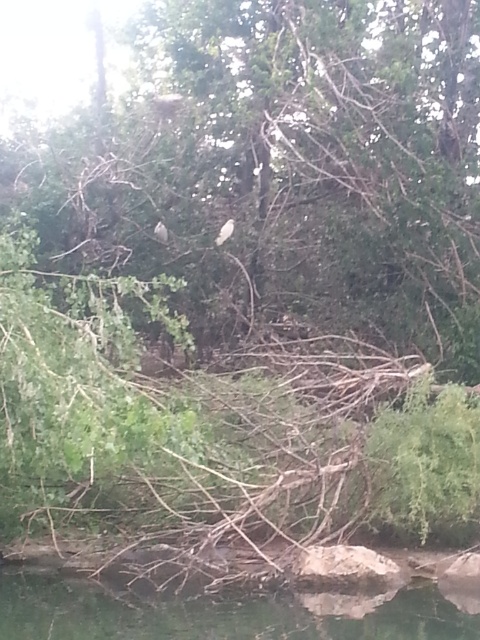
Question: Is green leafy tree at center further to camera compared to white matte bird at upper center?

Choices:
 (A) no
 (B) yes

Answer: (A)

Question: Which of the following is the closest to the observer?

Choices:
 (A) green leafy tree at center
 (B) white matte bird at upper center

Answer: (A)

Question: Which point is closer to the camera?

Choices:
 (A) white matte bird at upper center
 (B) green leafy tree at center

Answer: (B)

Question: Does green leafy tree at center have a greater width compared to white matte bird at upper center?

Choices:
 (A) yes
 (B) no

Answer: (A)

Question: Is green leafy tree at center thinner than white matte bird at upper center?

Choices:
 (A) yes
 (B) no

Answer: (B)